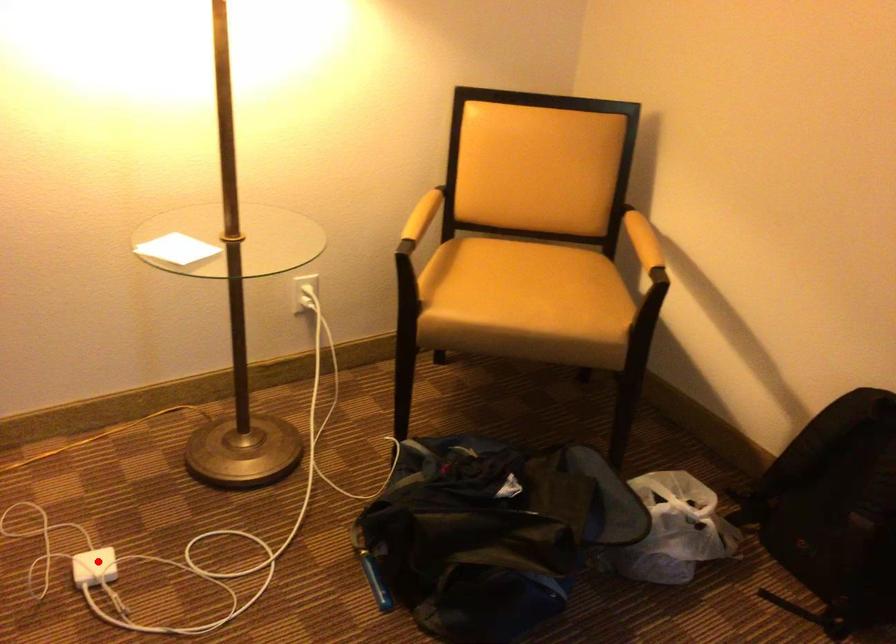
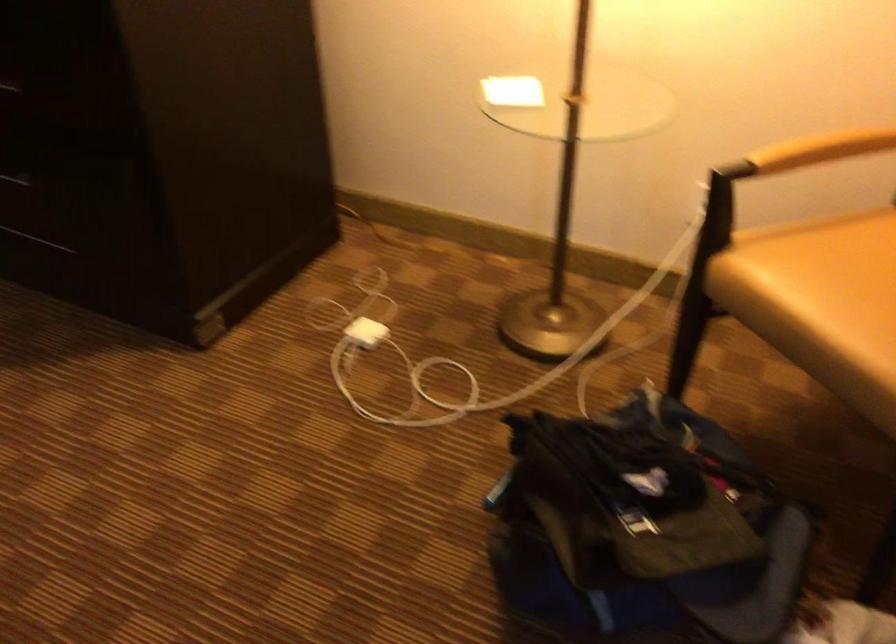
Question: I am providing you with two images of the same scene from different viewpoints. A red point is marked on the first image. Is the red point's position out of view in image 2?

Choices:
 (A) Yes
 (B) No

Answer: (B)